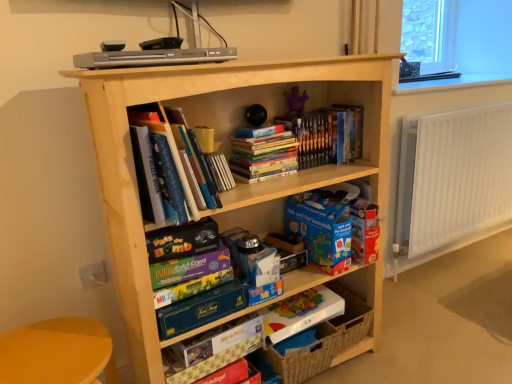
Question: Would you say blue cardboard book at center, the 2th paperback book in the top-to-bottom sequence, contains white metallic radiator at right?

Choices:
 (A) yes
 (B) no

Answer: (B)

Question: From the image's perspective, is blue cardboard book at center, which is the 5th paperback book in bottom-to-top order, under white metallic radiator at right?

Choices:
 (A) no
 (B) yes

Answer: (B)

Question: Is blue cardboard book at center, which is the 5th paperback book in bottom-to-top order, bigger than white metallic radiator at right?

Choices:
 (A) no
 (B) yes

Answer: (A)

Question: Can you confirm if blue cardboard book at center, which is the 5th paperback book in bottom-to-top order, is wider than white metallic radiator at right?

Choices:
 (A) no
 (B) yes

Answer: (B)

Question: From a real-world perspective, is blue cardboard book at center, which is the 5th paperback book in bottom-to-top order, on white metallic radiator at right?

Choices:
 (A) yes
 (B) no

Answer: (A)

Question: Does blue cardboard book at center, which is the 5th paperback book in bottom-to-top order, have a greater height compared to white metallic radiator at right?

Choices:
 (A) no
 (B) yes

Answer: (A)

Question: Does hardcover books at center, the second book viewed from the right, have a lesser height compared to matte blue book at center, arranged as the first paperback book when viewed from the top?

Choices:
 (A) yes
 (B) no

Answer: (B)

Question: Is hardcover books at center, the second book viewed from the right, closer to the viewer compared to matte blue book at center, which is the 6th paperback book in bottom-to-top order?

Choices:
 (A) yes
 (B) no

Answer: (B)

Question: Is hardcover books at center, the second book from the left, at the right side of matte blue book at center, which is the 6th paperback book in bottom-to-top order?

Choices:
 (A) yes
 (B) no

Answer: (A)

Question: Is hardcover books at center, the second book viewed from the right, positioned far away from matte blue book at center, which is the 6th paperback book in bottom-to-top order?

Choices:
 (A) yes
 (B) no

Answer: (B)

Question: From the image's perspective, is hardcover books at center, the second book viewed from the right, located above matte blue book at center, arranged as the first paperback book when viewed from the top?

Choices:
 (A) yes
 (B) no

Answer: (A)

Question: From a real-world perspective, does hardcover books at center, the second book viewed from the right, stand above matte blue book at center, which is the 6th paperback book in bottom-to-top order?

Choices:
 (A) yes
 (B) no

Answer: (A)

Question: Considering the relative sizes of hardcover books at upper center, placed as the third book when sorted from left to right, and yellow plastic table at lower left in the image provided, is hardcover books at upper center, placed as the third book when sorted from left to right, wider than yellow plastic table at lower left?

Choices:
 (A) no
 (B) yes

Answer: (A)